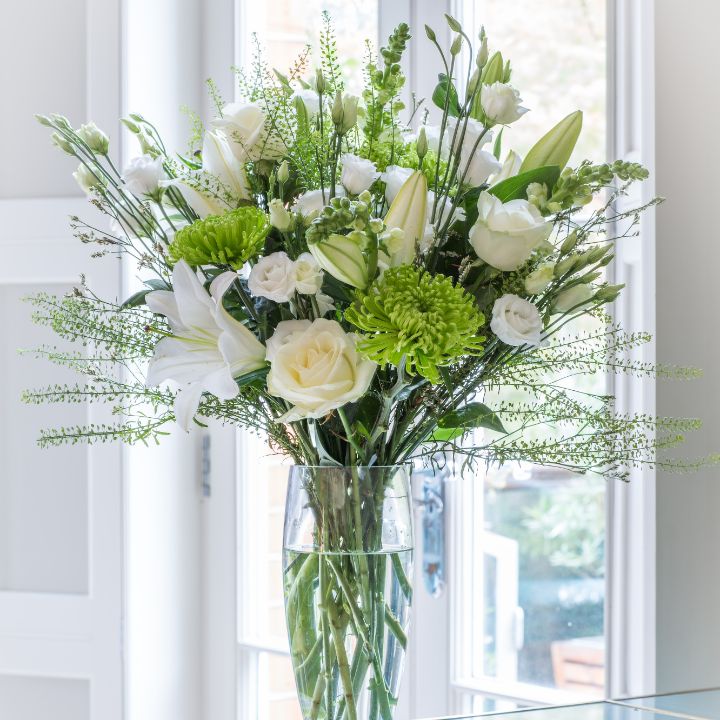
This screenshot has height=720, width=720. In order to click on tabletop in this screenshot , I will do `click(677, 700)`.